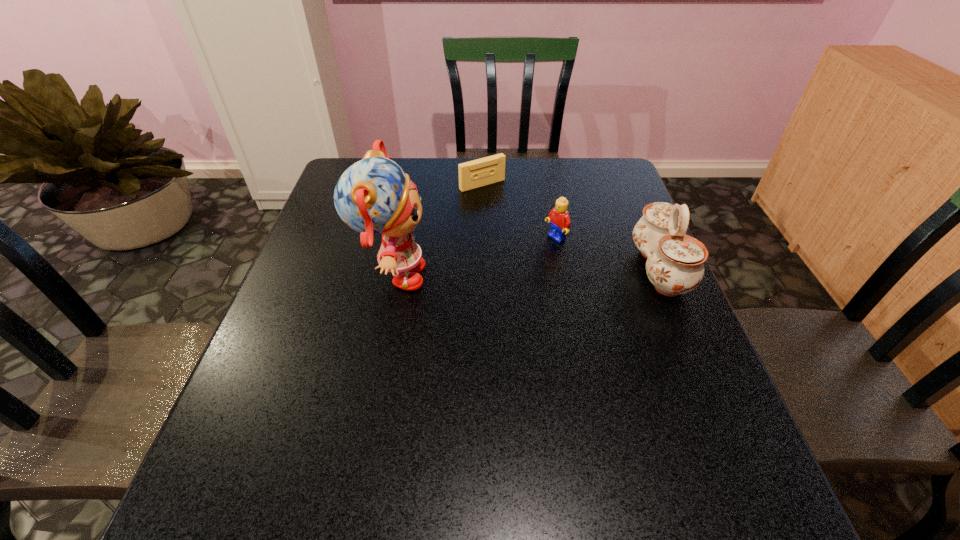
What are the coordinates of `object located in the right edge section of the desktop` in the screenshot? It's located at (675, 261).

The width and height of the screenshot is (960, 540). Find the location of `free region at the far edge of the desktop`. free region at the far edge of the desktop is located at coordinates (542, 182).

In the image, there is a desktop. Find the location of `free space at the near edge`. free space at the near edge is located at coordinates (613, 446).

In the image, there is a desktop. Identify the location of vacant region at the left edge. (303, 274).

The width and height of the screenshot is (960, 540). Identify the location of free region at the right edge. (684, 343).

I want to click on vacant region at the far left corner of the desktop, so click(x=340, y=173).

In the image, there is a desktop. Where is `vacant space at the near left corner`? This screenshot has height=540, width=960. vacant space at the near left corner is located at coordinates (263, 434).

Identify the location of free region at the far right corner. (618, 166).

The image size is (960, 540). What are the coordinates of `vacant area between the third shortest object and the doll` in the screenshot? It's located at click(x=526, y=274).

Where is `free space between the third tallest object and the chinaware`? The image size is (960, 540). free space between the third tallest object and the chinaware is located at coordinates (608, 254).